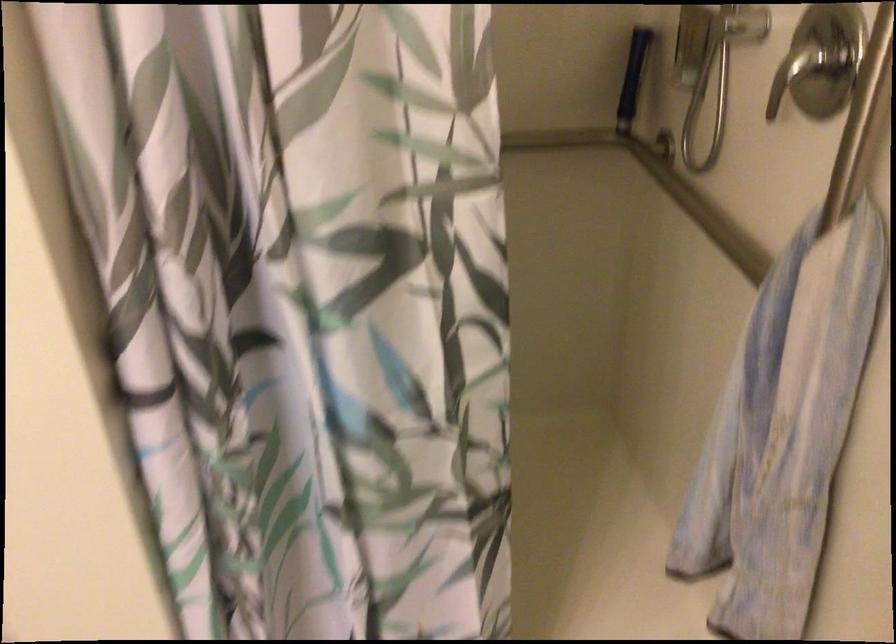
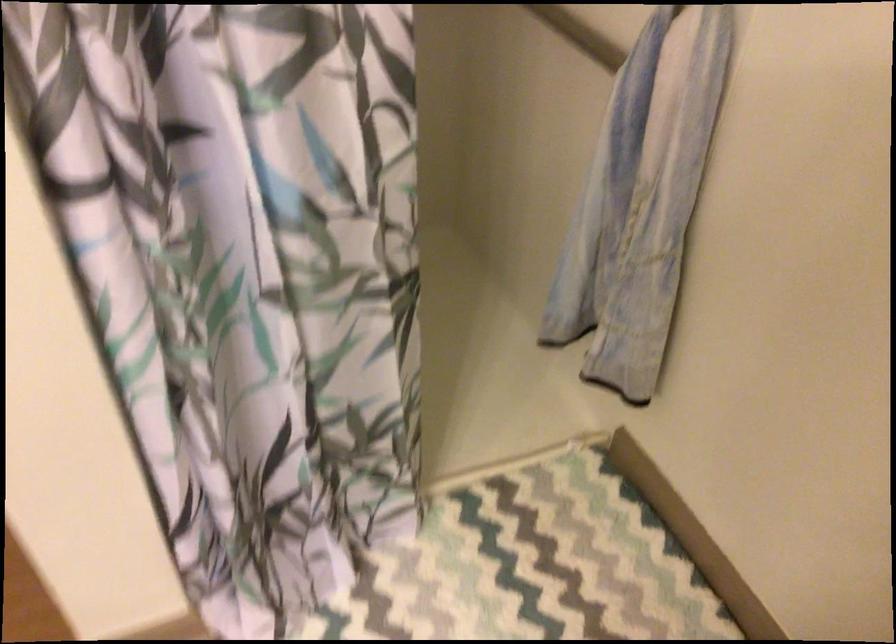
Question: How did the camera likely rotate?

Choices:
 (A) Left
 (B) Right
 (C) Up
 (D) Down

Answer: (B)